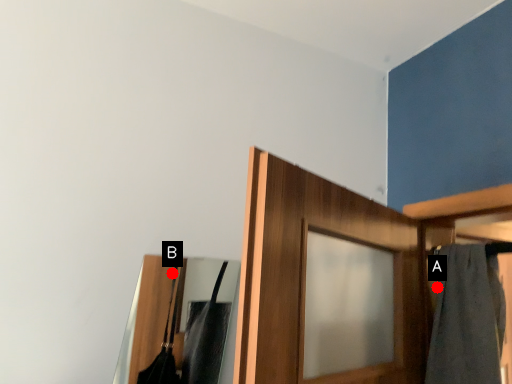
Question: Two points are circled on the image, labeled by A and B beside each circle. Among these points, which one is nearest to the camera?

Choices:
 (A) A is closer
 (B) B is closer

Answer: (A)